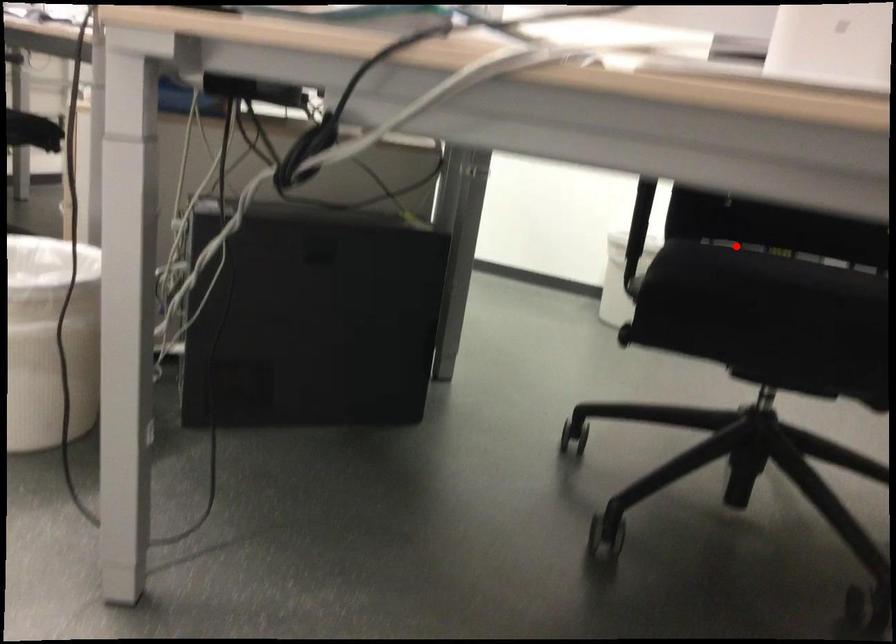
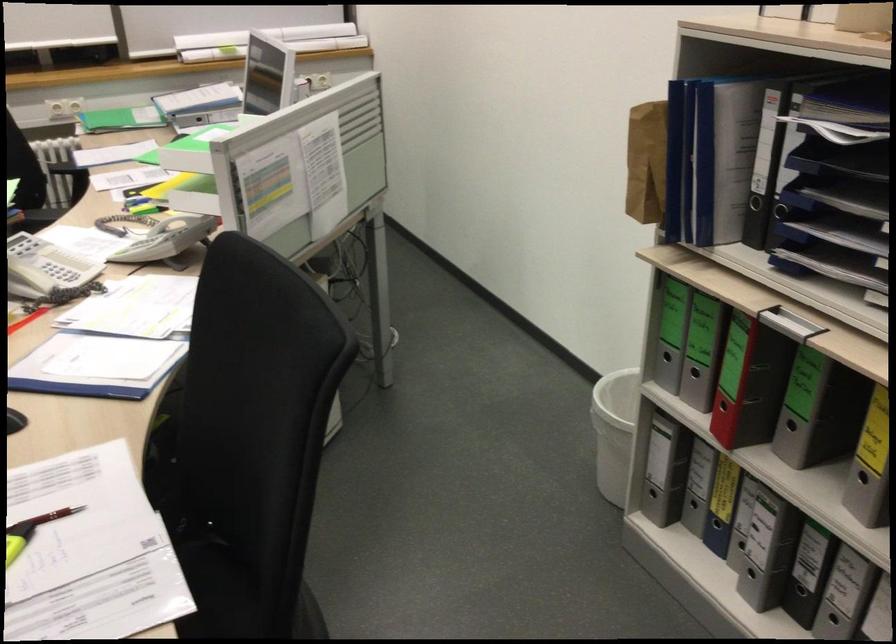
Locate, in the second image, the point that corresponds to the highlighted location in the first image.

(208, 581)